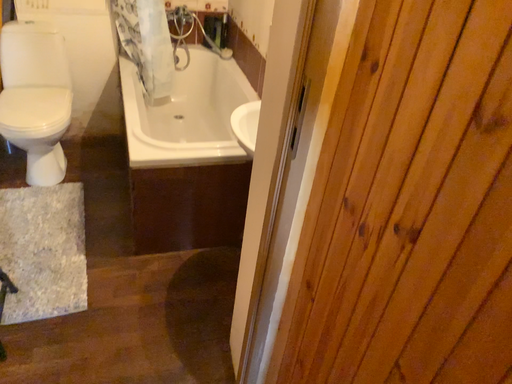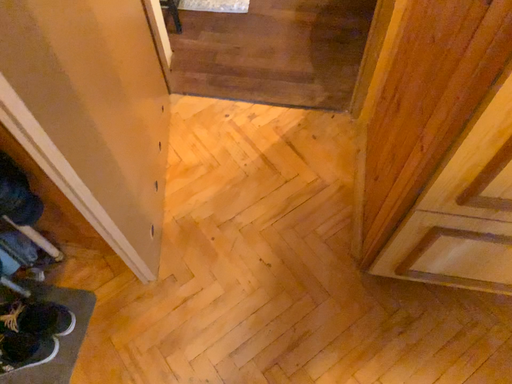
Question: Which way did the camera rotate in the video?

Choices:
 (A) rotated right
 (B) rotated left

Answer: (B)